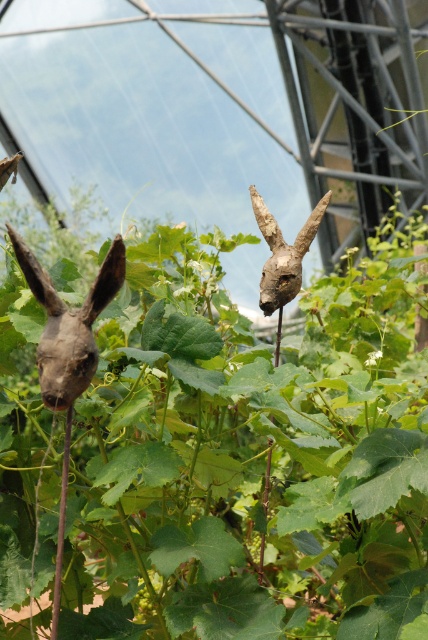
Between wooden rabbit head at left and wooden rabbit head at center, which one is positioned lower?

wooden rabbit head at left is lower down.

This screenshot has height=640, width=428. What do you see at coordinates (68, 323) in the screenshot?
I see `wooden rabbit head at left` at bounding box center [68, 323].

The height and width of the screenshot is (640, 428). What are the coordinates of `wooden rabbit head at left` in the screenshot? It's located at (68, 323).

Between point (392, 330) and point (314, 228), which one is positioned behind?

Point (392, 330)

Is green leafy plant at center to the left of wooden rabbit head at center from the viewer's perspective?

Yes, green leafy plant at center is to the left of wooden rabbit head at center.

Between point (410, 544) and point (291, 257), which one is positioned behind?

Positioned behind is point (291, 257).

At what (x,y) coordinates should I click in order to perform the action: click on green leafy plant at center. Please return your answer as a coordinate pair (x, y). The height and width of the screenshot is (640, 428). Looking at the image, I should click on (216, 451).

Does point (181, 376) come farther from viewer compared to point (67, 396)?

Yes, it is.

Measure the distance between green leafy plant at center and wooden rabbit head at left.

green leafy plant at center is 14.41 inches away from wooden rabbit head at left.

Which is in front, point (401, 413) or point (121, 244)?

Point (121, 244)

Find the location of a particular element. This screenshot has width=428, height=640. green leafy plant at center is located at coordinates tap(216, 451).